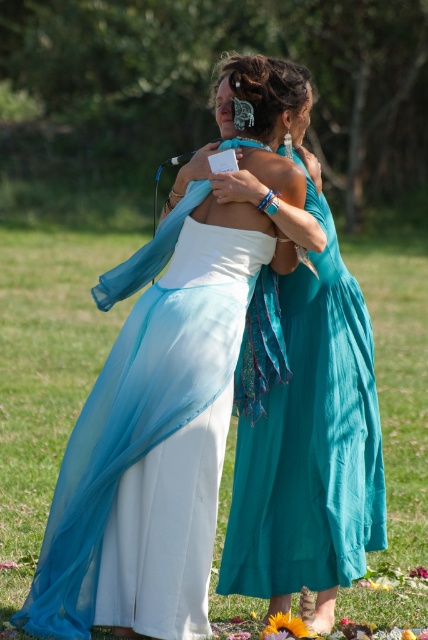
Question: Which point is farther to the camera?

Choices:
 (A) teal chiffon dress at center
 (B) white satin dress at center

Answer: (A)

Question: Which of the following is the farthest from the observer?

Choices:
 (A) (192, 563)
 (B) (253, 496)

Answer: (B)

Question: Considering the relative positions of white satin dress at center and teal chiffon dress at center in the image provided, where is white satin dress at center located with respect to teal chiffon dress at center?

Choices:
 (A) right
 (B) left

Answer: (B)

Question: Which object is closer to the camera taking this photo?

Choices:
 (A) teal chiffon dress at center
 (B) white satin dress at center

Answer: (B)

Question: Can you confirm if white satin dress at center is positioned above teal chiffon dress at center?

Choices:
 (A) no
 (B) yes

Answer: (B)

Question: Does white satin dress at center appear over teal chiffon dress at center?

Choices:
 (A) yes
 (B) no

Answer: (A)